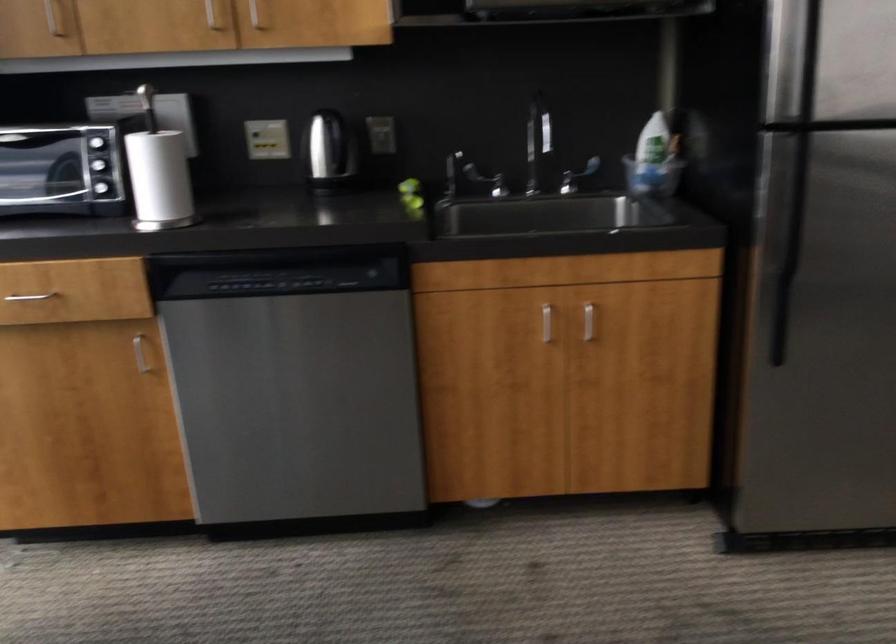
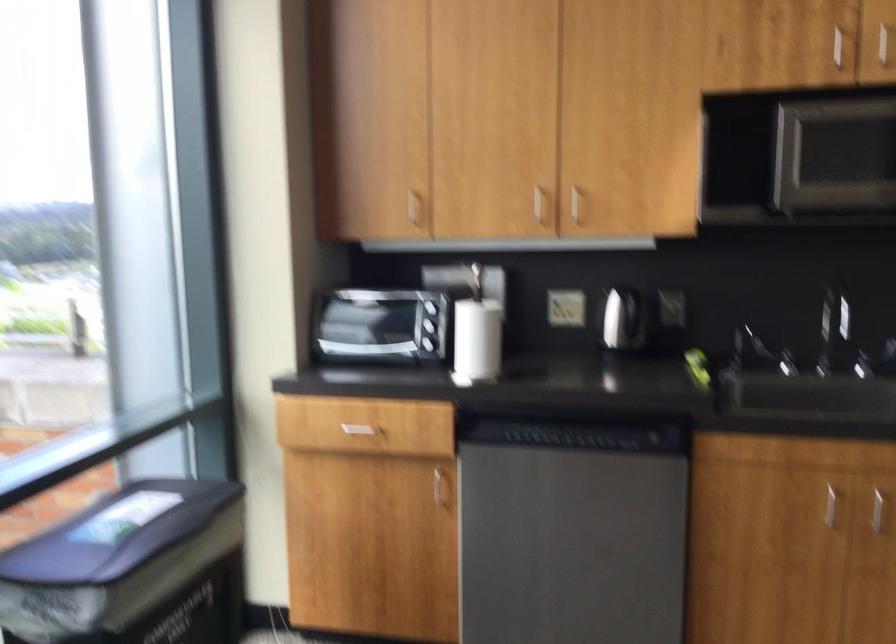
The images are taken continuously from a first-person perspective. In which direction are you moving?

The movement direction of the cameraman is right, backward.